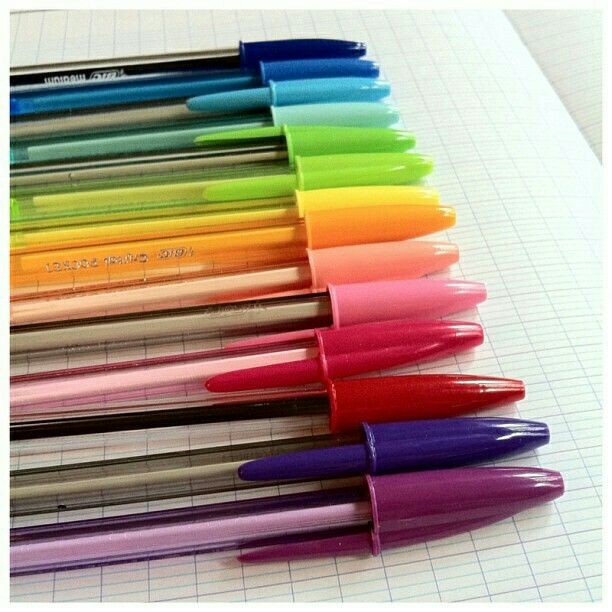
You are a GUI agent. You are given a task and a screenshot of the screen. Output one action in this format:
    pyautogui.click(x=<x>, y=<y>)
    Task: Click on the first 5 pens from the front of the photo
    This screenshot has height=612, width=612.
    Given the screenshot: What is the action you would take?
    pyautogui.click(x=459, y=504), pyautogui.click(x=430, y=442), pyautogui.click(x=404, y=396), pyautogui.click(x=379, y=343), pyautogui.click(x=373, y=297)